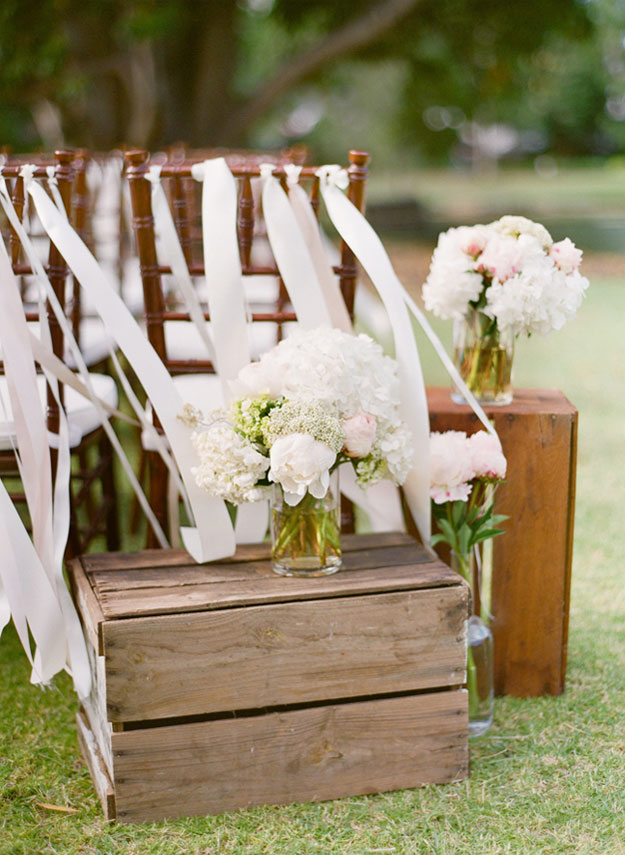
I want to click on chairs, so click(250, 190), click(178, 156), click(82, 225), click(55, 338).